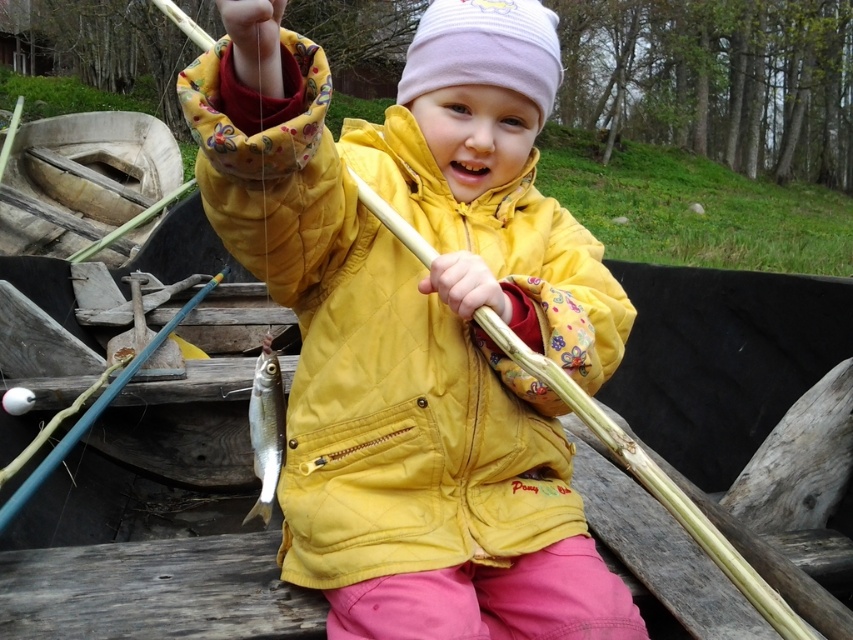
Question: Does yellow quilted jacket at center appear on the right side of shiny silver fish at center?

Choices:
 (A) no
 (B) yes

Answer: (B)

Question: Among these points, which one is farthest from the camera?

Choices:
 (A) (355, 433)
 (B) (274, 468)

Answer: (B)

Question: Which of the following is the farthest from the observer?

Choices:
 (A) (527, 417)
 (B) (260, 502)

Answer: (A)

Question: Does yellow quilted jacket at center appear on the left side of shiny silver fish at center?

Choices:
 (A) no
 (B) yes

Answer: (A)

Question: Which object is closer to the camera taking this photo?

Choices:
 (A) yellow quilted jacket at center
 (B) shiny silver fish at center

Answer: (A)

Question: Can you confirm if yellow quilted jacket at center is thinner than shiny silver fish at center?

Choices:
 (A) no
 (B) yes

Answer: (A)